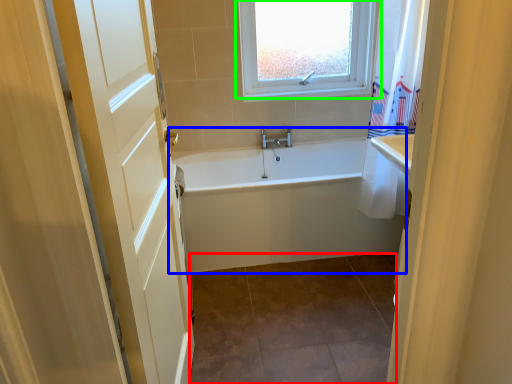
Question: Which object is positioned closest to tile (highlighted by a red box)? Select from bathtub (highlighted by a blue box) and window (highlighted by a green box).

Choices:
 (A) bathtub
 (B) window

Answer: (A)